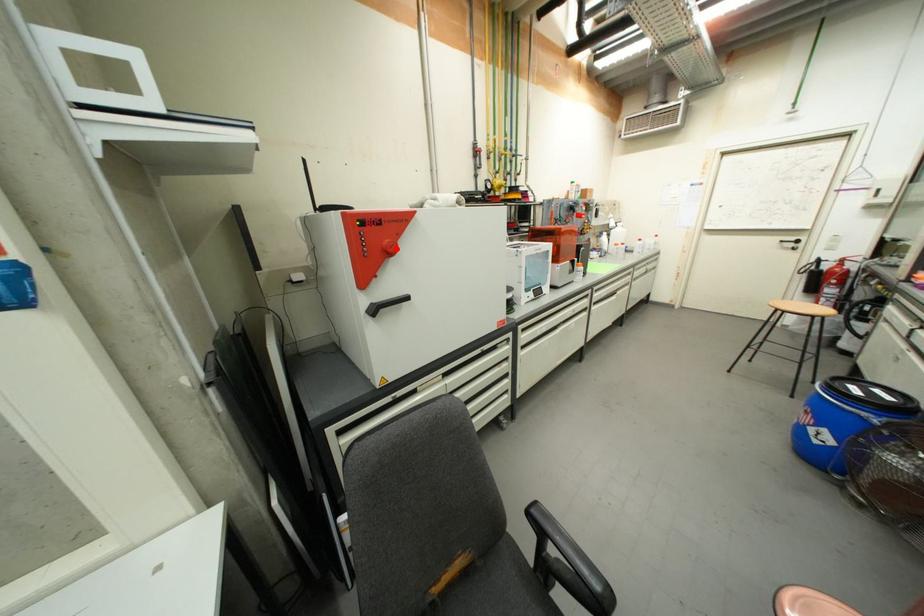
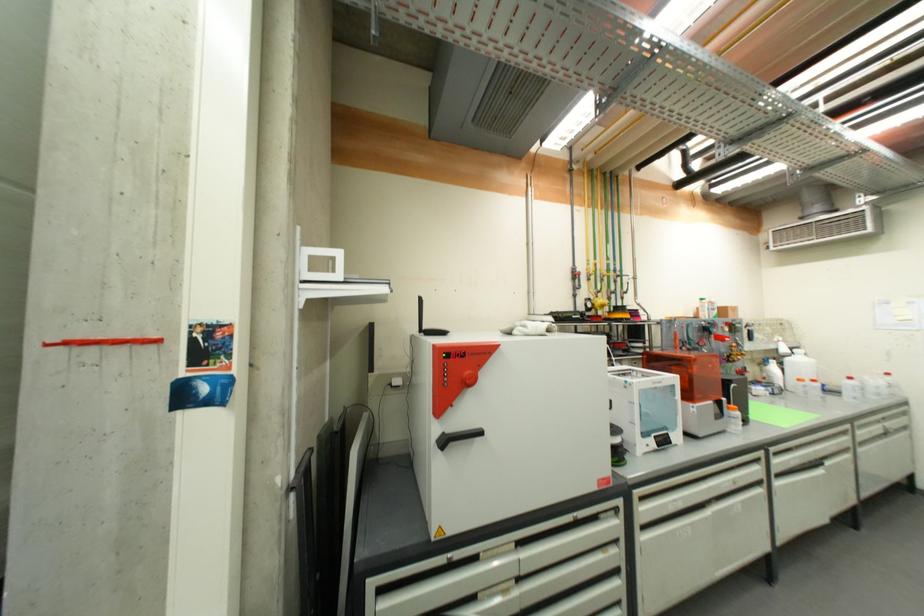
Locate, in the second image, the point that corresponds to the highlighted location in the first image.

(476, 381)